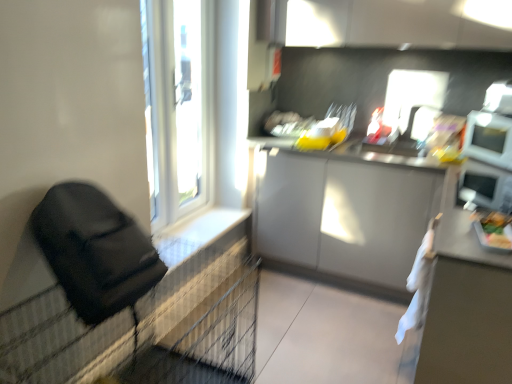
Locate an element on the screen. The width and height of the screenshot is (512, 384). free region under green matte tray at right (from a real-world perspective) is located at coordinates (481, 230).